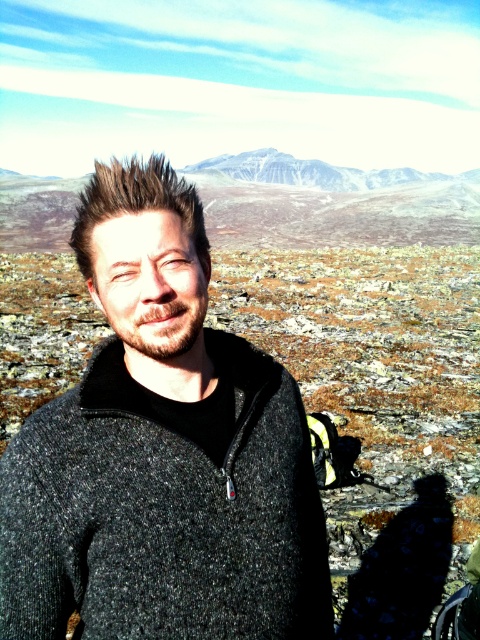
Question: Can you confirm if charcoal wool sweater at center is smaller than snowy granite mountain at upper center?

Choices:
 (A) no
 (B) yes

Answer: (B)

Question: Can you confirm if charcoal wool sweater at center is positioned to the left of snowy granite mountain at upper center?

Choices:
 (A) yes
 (B) no

Answer: (A)

Question: Can you confirm if charcoal wool sweater at center is positioned above snowy granite mountain at upper center?

Choices:
 (A) no
 (B) yes

Answer: (A)

Question: Which object appears closest to the camera in this image?

Choices:
 (A) charcoal wool sweater at center
 (B) snowy granite mountain at upper center

Answer: (A)

Question: Which point appears farthest from the camera in this image?

Choices:
 (A) (180, 301)
 (B) (371, 177)

Answer: (B)

Question: Which of the following is the closest to the observer?

Choices:
 (A) snowy granite mountain at upper center
 (B) charcoal wool sweater at center

Answer: (B)